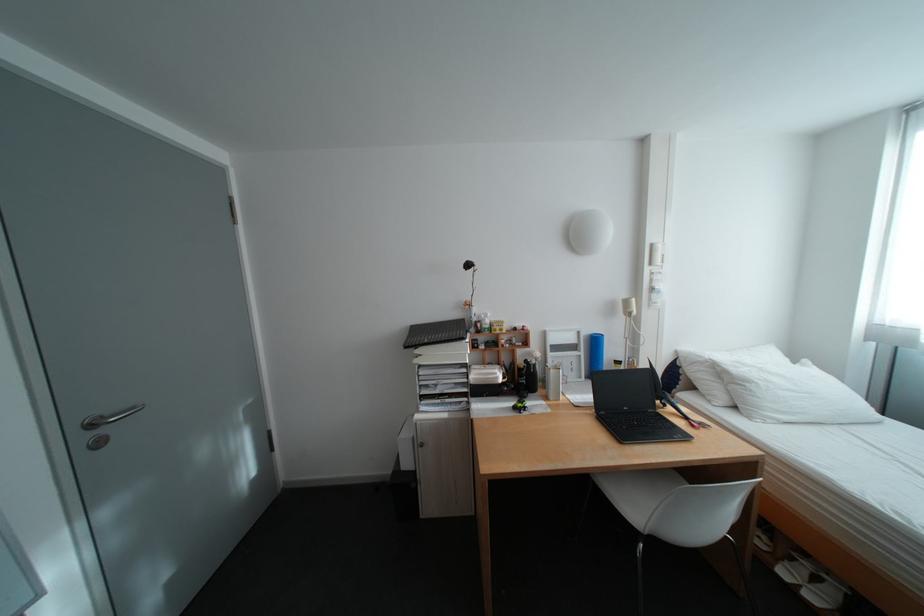
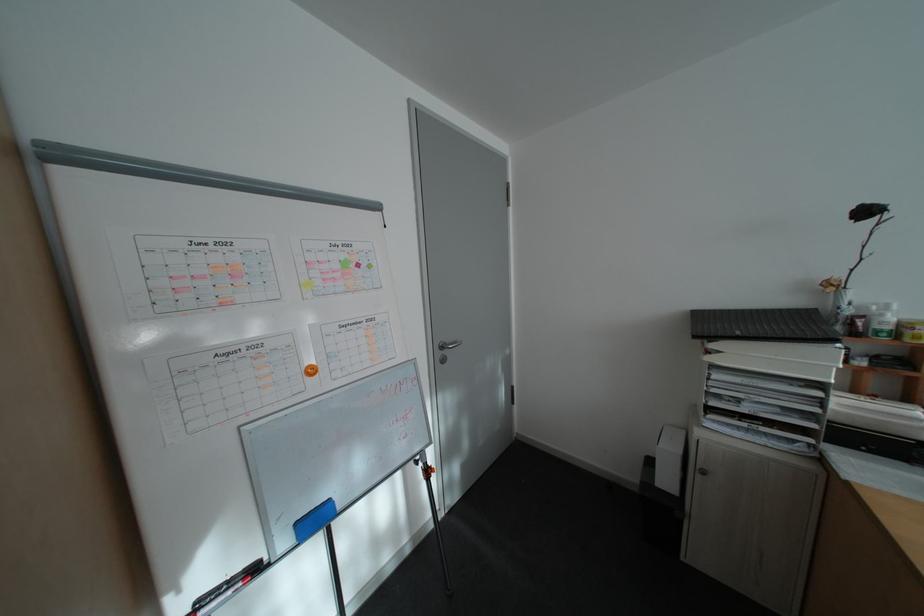
Question: Based on the continuous images, in which direction is the camera rotating? Reply with the corresponding letter.

Choices:
 (A) Left
 (B) Right
 (C) Up
 (D) Down

Answer: (A)